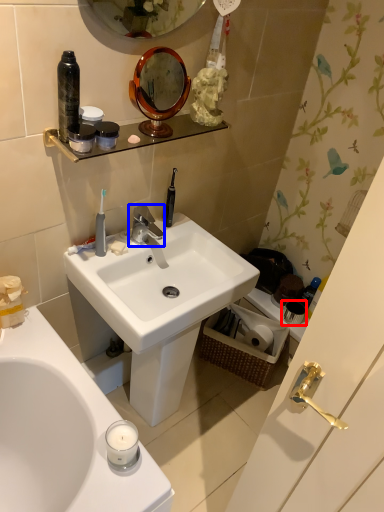
Question: Which object is further to the camera taking this photo, toiletry (highlighted by a red box) or tap (highlighted by a blue box)?

Choices:
 (A) toiletry
 (B) tap

Answer: (A)